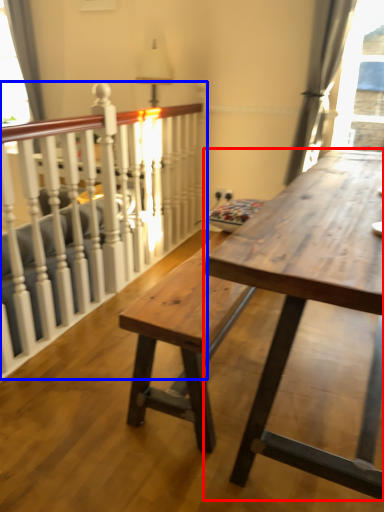
Question: Among these objects, which one is farthest to the camera, table (highlighted by a red box) or rail (highlighted by a blue box)?

Choices:
 (A) table
 (B) rail

Answer: (B)